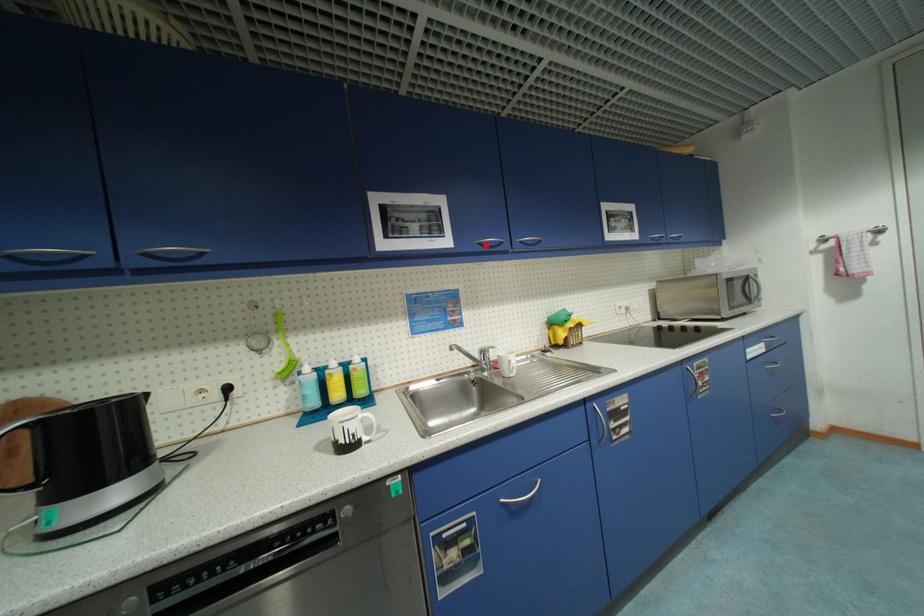
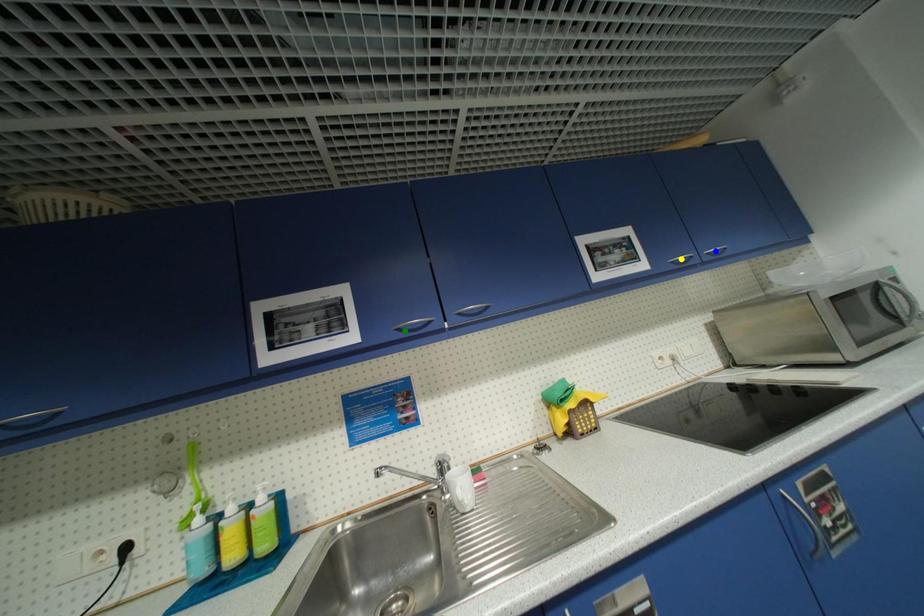
Question: I am providing you with two images of the same scene from different viewpoints. A red point is marked on the first image. You are given multiple points on the second image. Can you choose the point in image 2 that corresponds to the point in image 1?

Choices:
 (A) yellow point
 (B) green point
 (C) blue point

Answer: (B)